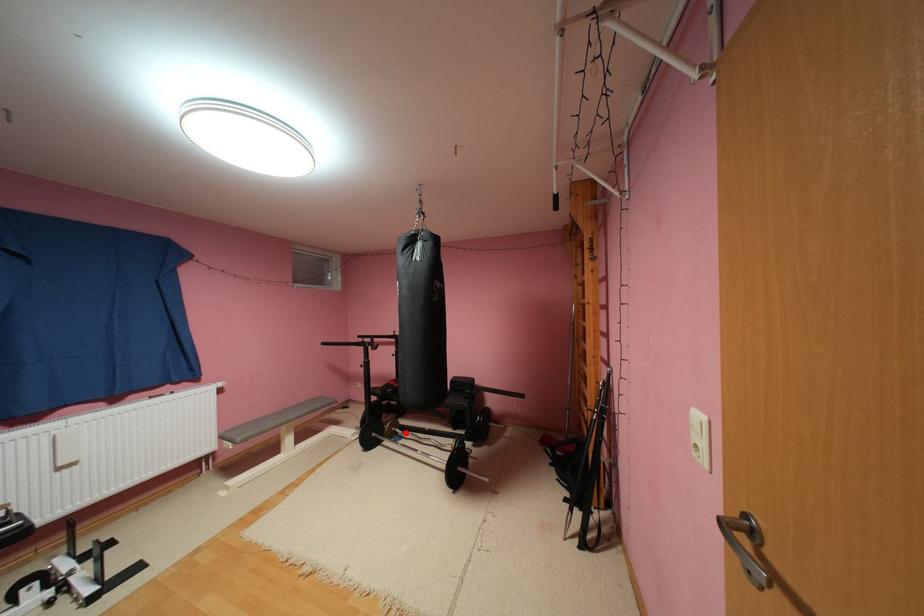
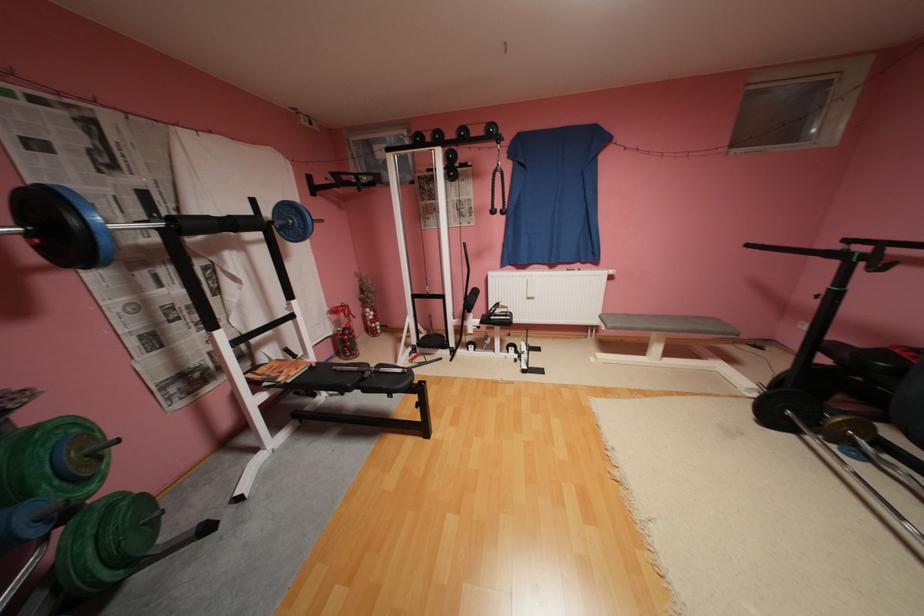
In the second image, find the point that corresponds to the highlighted location in the first image.

(867, 445)